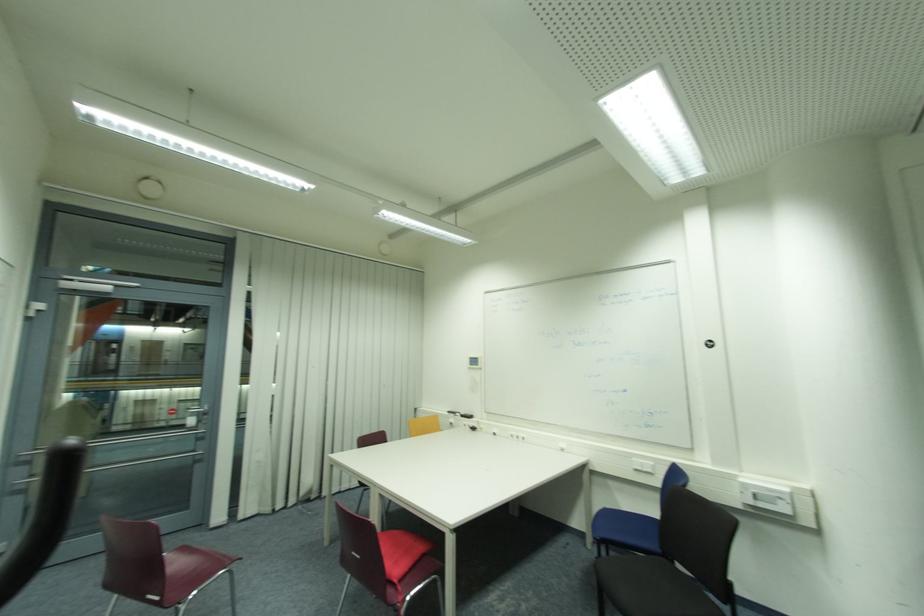
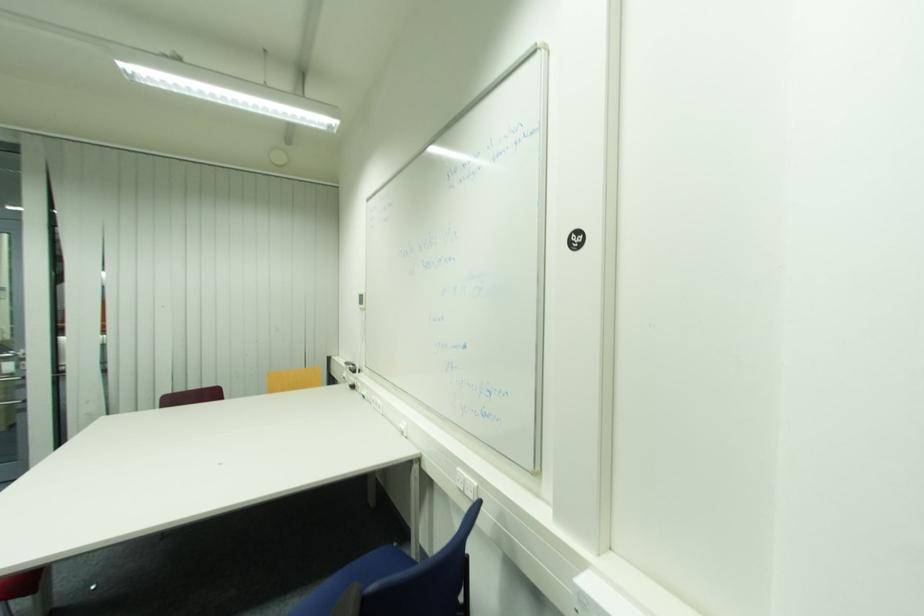
From the picture: What movement of the cameraman would produce the second image?

The cameraman walked toward right, forward.